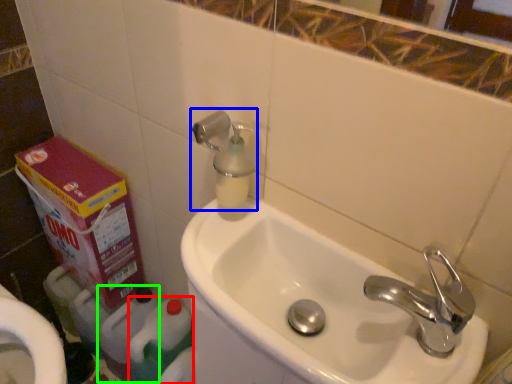
Question: Considering the real-world distances, which object is farthest from cleaning product (highlighted by a red box)? plumbing fixture (highlighted by a blue box) or cleaning product (highlighted by a green box)?

Choices:
 (A) plumbing fixture
 (B) cleaning product

Answer: (A)